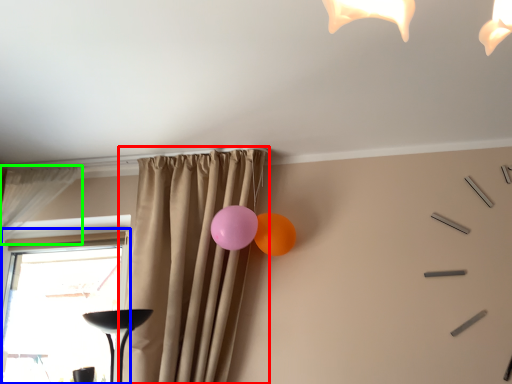
Question: Which object is the closest to the curtain (highlighted by a red box)? Choose among these: window (highlighted by a blue box) or curtain (highlighted by a green box).

Choices:
 (A) window
 (B) curtain

Answer: (B)